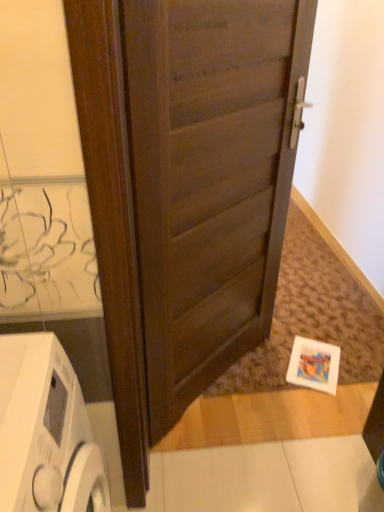
Question: Looking at the image, does white glossy washing machine at lower left seem bigger or smaller compared to dark wood door at center?

Choices:
 (A) small
 (B) big

Answer: (A)

Question: In terms of height, does white glossy washing machine at lower left look taller or shorter compared to dark wood door at center?

Choices:
 (A) short
 (B) tall

Answer: (A)

Question: In terms of width, does white glossy washing machine at lower left look wider or thinner when compared to dark wood door at center?

Choices:
 (A) wide
 (B) thin

Answer: (A)

Question: Is dark wood door at center wider or thinner than white glossy washing machine at lower left?

Choices:
 (A) thin
 (B) wide

Answer: (A)

Question: Based on their positions, is dark wood door at center located to the left or right of white glossy washing machine at lower left?

Choices:
 (A) right
 (B) left

Answer: (A)

Question: Is point (173, 72) positioned closer to the camera than point (1, 373)?

Choices:
 (A) closer
 (B) farther

Answer: (B)

Question: Considering the positions of dark wood door at center and white glossy washing machine at lower left in the image, is dark wood door at center taller or shorter than white glossy washing machine at lower left?

Choices:
 (A) short
 (B) tall

Answer: (B)